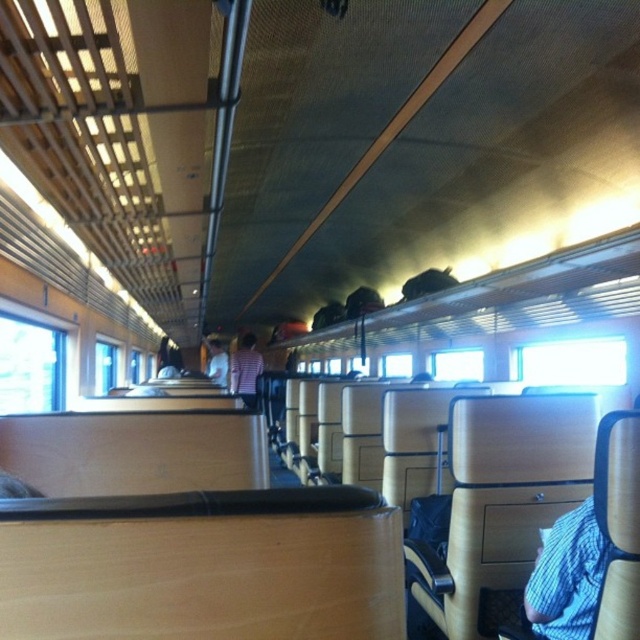
Question: Does blue knitted sweater at lower right have a smaller size compared to striped fabric shirt at center?

Choices:
 (A) yes
 (B) no

Answer: (A)

Question: Which point is closer to the camera?

Choices:
 (A) striped fabric shirt at center
 (B) blue knitted sweater at lower right

Answer: (B)

Question: Can you confirm if blue knitted sweater at lower right is thinner than white fabric shirt at center?

Choices:
 (A) yes
 (B) no

Answer: (A)

Question: Which point is closer to the camera?

Choices:
 (A) (248, 337)
 (B) (218, 362)

Answer: (A)

Question: Which object appears closest to the camera in this image?

Choices:
 (A) blue knitted sweater at lower right
 (B) white fabric shirt at center
 (C) striped fabric shirt at center

Answer: (A)

Question: Is striped fabric shirt at center thinner than white fabric shirt at center?

Choices:
 (A) yes
 (B) no

Answer: (A)